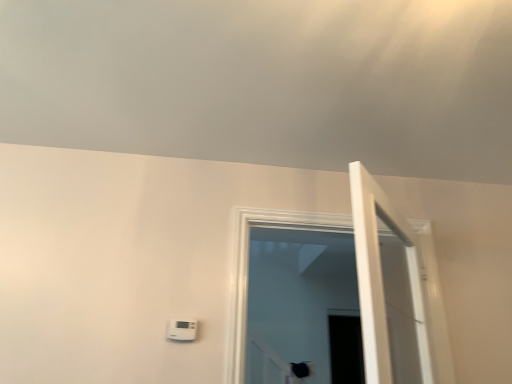
Question: Is transparent glass door at center positioned in front of white wooden door at right?

Choices:
 (A) no
 (B) yes

Answer: (A)

Question: Is transparent glass door at center further to camera compared to white wooden door at right?

Choices:
 (A) yes
 (B) no

Answer: (A)

Question: Is white wooden door at right at the back of transparent glass door at center?

Choices:
 (A) no
 (B) yes

Answer: (B)

Question: Is transparent glass door at center facing towards white wooden door at right?

Choices:
 (A) no
 (B) yes

Answer: (B)

Question: Considering the relative sizes of transparent glass door at center and white wooden door at right in the image provided, is transparent glass door at center taller than white wooden door at right?

Choices:
 (A) yes
 (B) no

Answer: (A)

Question: Choose the correct answer: Is transparent glass door at center inside white wooden door at right or outside it?

Choices:
 (A) inside
 (B) outside

Answer: (B)

Question: Considering their positions, is transparent glass door at center located in front of or behind white wooden door at right?

Choices:
 (A) front
 (B) behind

Answer: (B)

Question: Is transparent glass door at center wider or thinner than white wooden door at right?

Choices:
 (A) thin
 (B) wide

Answer: (B)

Question: Is point (237, 236) closer or farther from the camera than point (352, 208)?

Choices:
 (A) closer
 (B) farther

Answer: (A)

Question: From their relative heights in the image, would you say white plastic thermostat at lower center is taller or shorter than white wooden door at right?

Choices:
 (A) tall
 (B) short

Answer: (B)

Question: Is white plastic thermostat at lower center bigger or smaller than white wooden door at right?

Choices:
 (A) small
 (B) big

Answer: (A)

Question: Is white plastic thermostat at lower center in front of or behind white wooden door at right in the image?

Choices:
 (A) front
 (B) behind

Answer: (B)

Question: Considering the positions of white plastic thermostat at lower center and white wooden door at right in the image, is white plastic thermostat at lower center wider or thinner than white wooden door at right?

Choices:
 (A) thin
 (B) wide

Answer: (A)

Question: Considering the positions of transparent glass door at center and white plastic thermostat at lower center in the image, is transparent glass door at center taller or shorter than white plastic thermostat at lower center?

Choices:
 (A) tall
 (B) short

Answer: (A)

Question: Based on their positions, is transparent glass door at center located to the left or right of white plastic thermostat at lower center?

Choices:
 (A) right
 (B) left

Answer: (A)